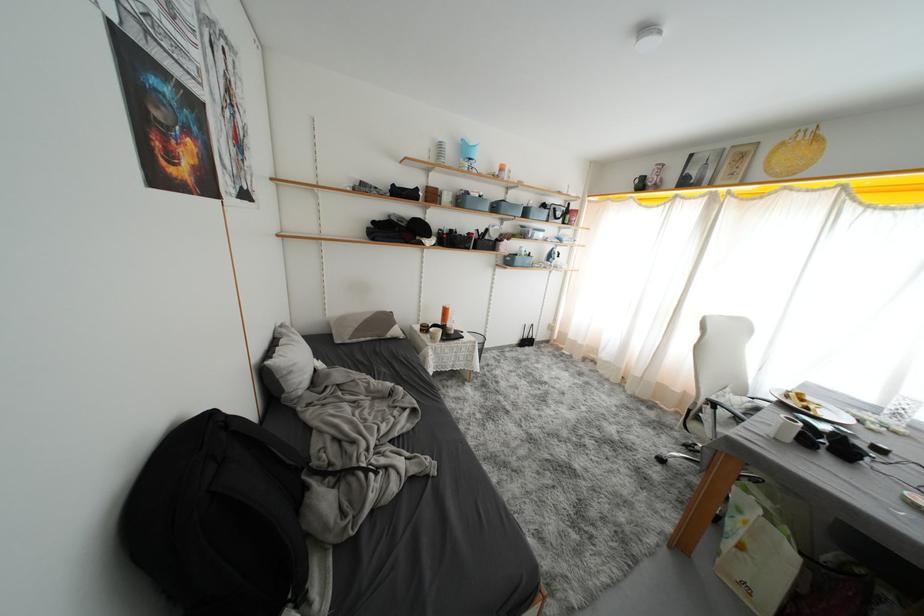
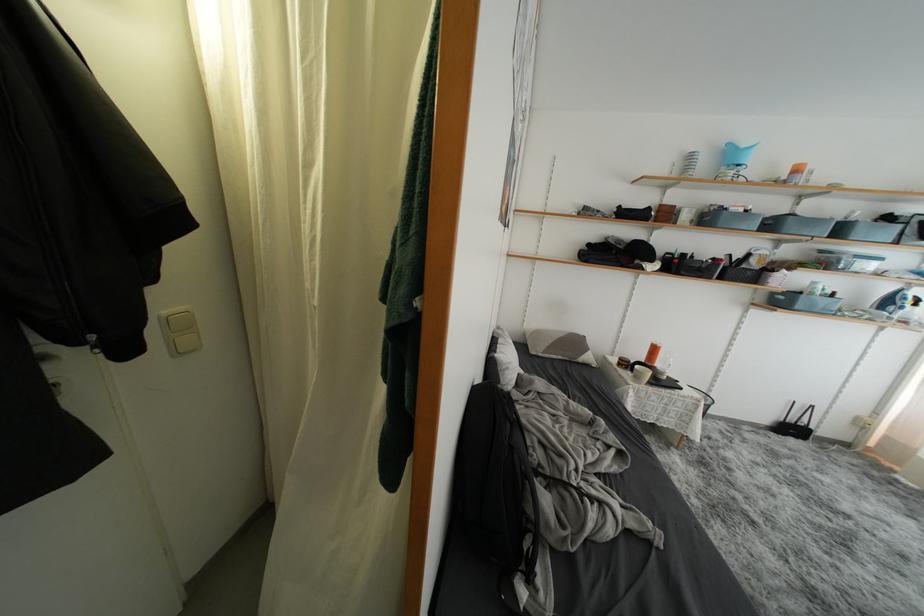
Where in the second image is the point corresponding to point (457, 198) from the first image?

(700, 215)